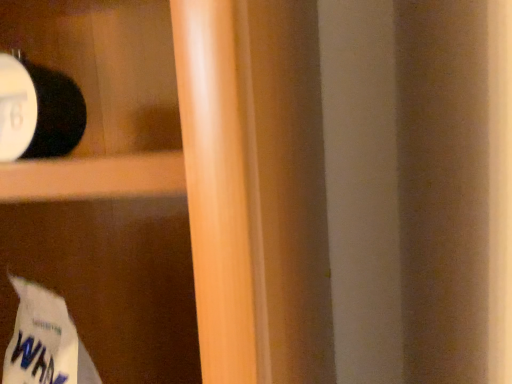
Question: Should I look upward or downward to see white paper grocery bag at lower left?

Choices:
 (A) up
 (B) down

Answer: (B)